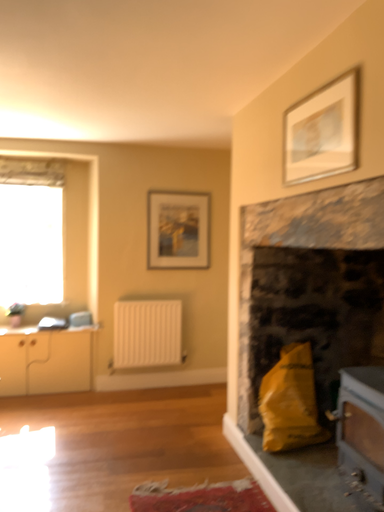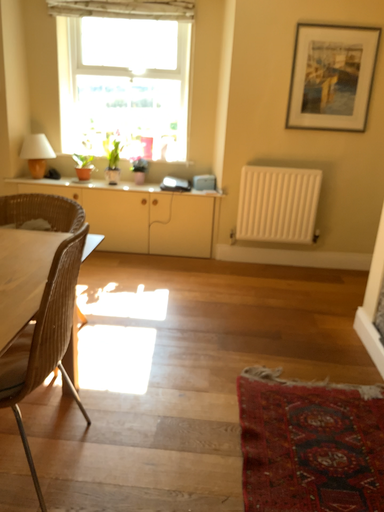
Question: How did the camera likely rotate when shooting the video?

Choices:
 (A) rotated left
 (B) rotated right

Answer: (A)